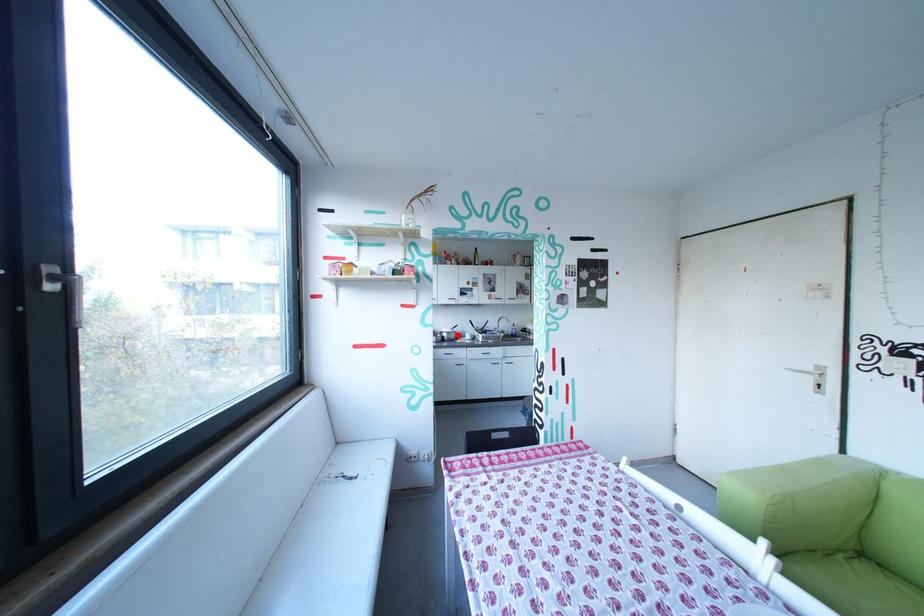
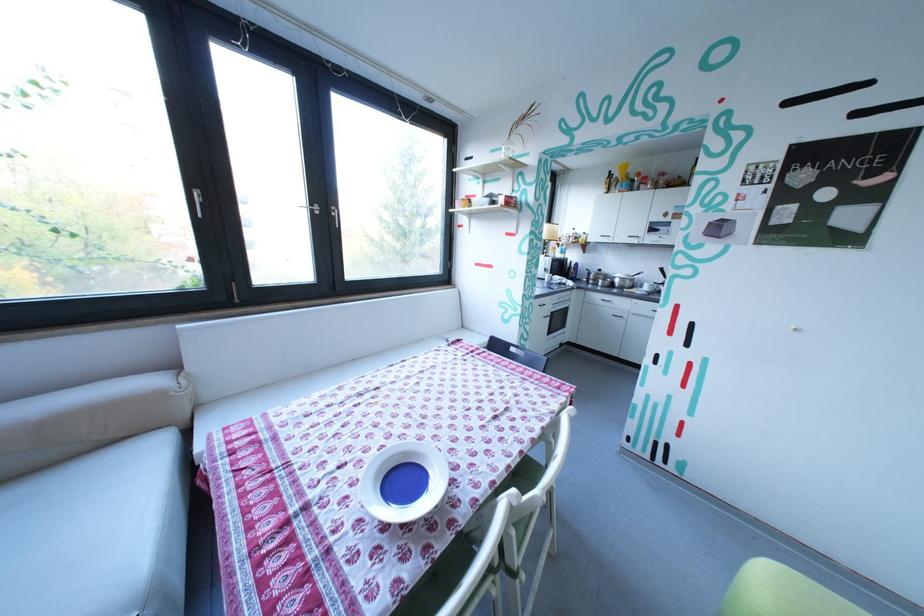
Locate, in the second image, the point that corresponds to the highlighted location in the first image.

(629, 281)